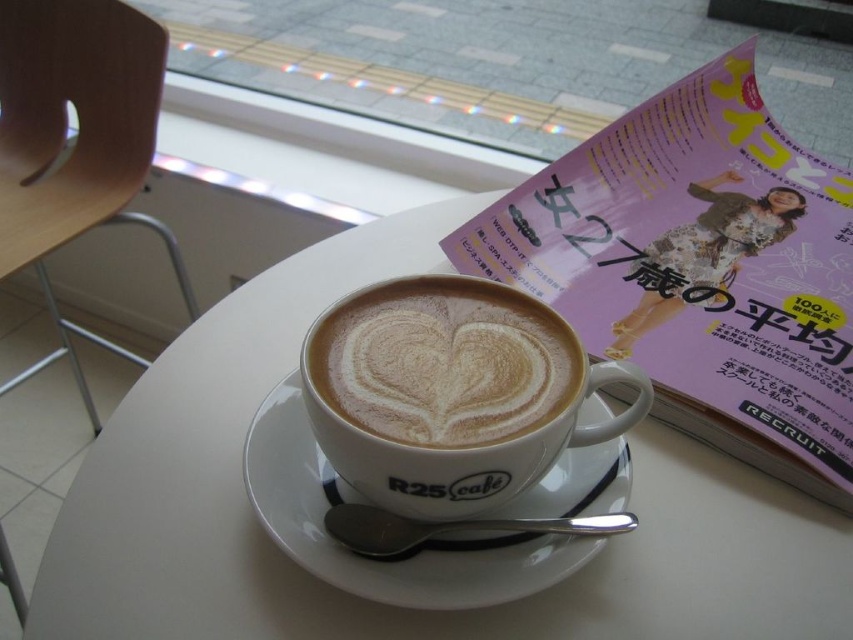
You are a customer at R25 cafe and want to place your phone between the two points, point (811, 538) and point (505, 394). Can you do that?

Point (811, 538) is further to the viewer than point (505, 394), so placing the phone between them is possible as they form a spatial plane.

You are a barista who needs to place a new menu card between the white ceramic table at center and the matte paper magazine at upper right. Since the menu card is 10 cm tall, can it fit vertically between them?

The white ceramic table at center is shorter than the matte paper magazine at upper right, so the vertical space between them is at least 10 cm. Therefore, the menu card can fit vertically between them.